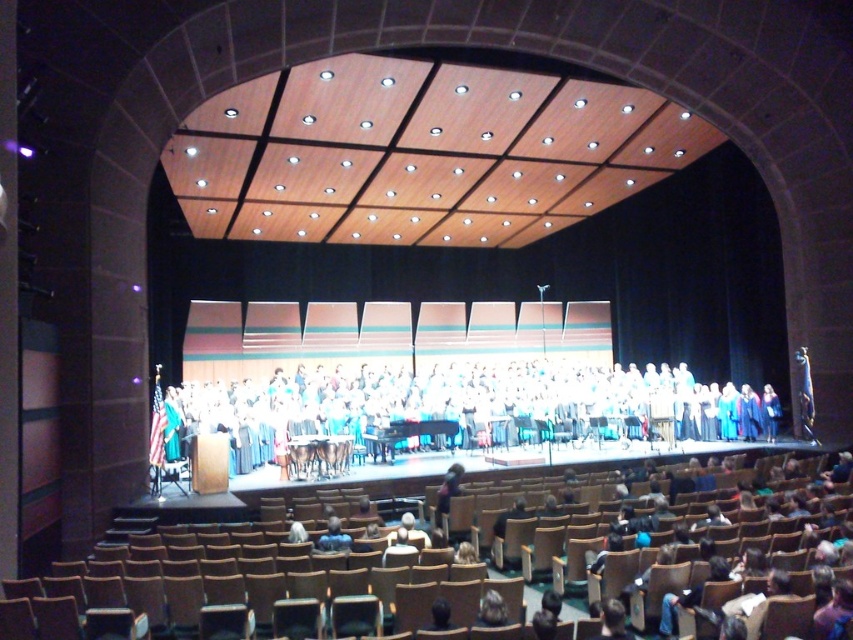
Between white fabric choir at center and light brown leather jacket at lower center, which one is positioned lower?

Positioned lower is light brown leather jacket at lower center.

Consider the image. Is white fabric choir at center shorter than light brown leather jacket at lower center?

No, white fabric choir at center is not shorter than light brown leather jacket at lower center.

Where is `white fabric choir at center`? white fabric choir at center is located at coordinates (461, 413).

Locate an element on the screen. white fabric choir at center is located at coordinates (461, 413).

Which of these two, dark brown leather jacket at center or light brown leather jacket at lower center, stands taller?

dark brown leather jacket at center

Which is more to the right, dark brown leather jacket at center or light brown leather jacket at lower center?

light brown leather jacket at lower center is more to the right.

What do you see at coordinates (447, 492) in the screenshot? I see `dark brown leather jacket at center` at bounding box center [447, 492].

Identify the location of dark brown leather jacket at center. (447, 492).

Is dark brown leather jacket at center thinner than black hair at center?

Incorrect, dark brown leather jacket at center's width is not less than black hair at center's.

Can you confirm if dark brown leather jacket at center is taller than black hair at center?

Yes.

Who is more forward, (437, 506) or (439, 618)?

Point (439, 618) is more forward.

At what (x,y) coordinates should I click in order to perform the action: click on dark brown leather jacket at center. Please return your answer as a coordinate pair (x, y). Image resolution: width=853 pixels, height=640 pixels. Looking at the image, I should click on (447, 492).